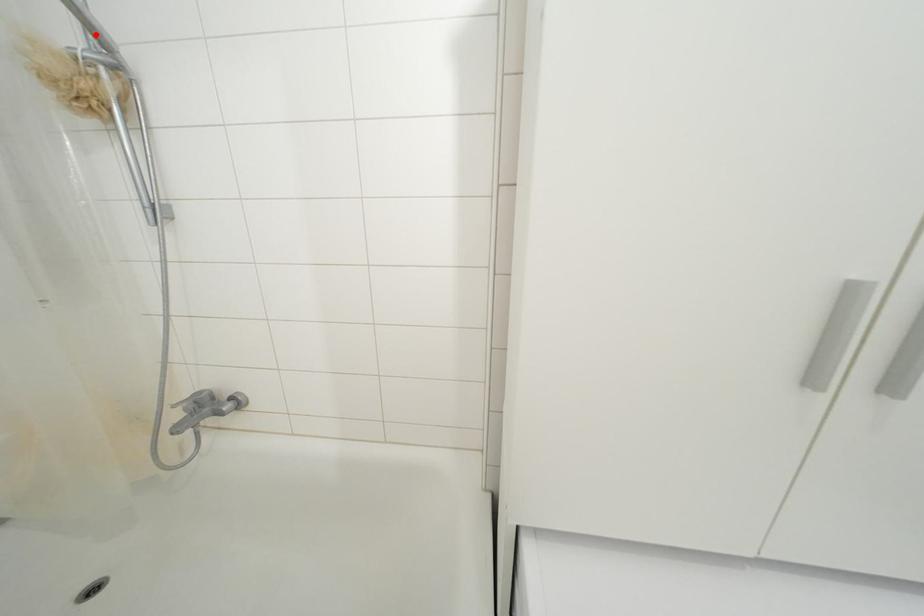
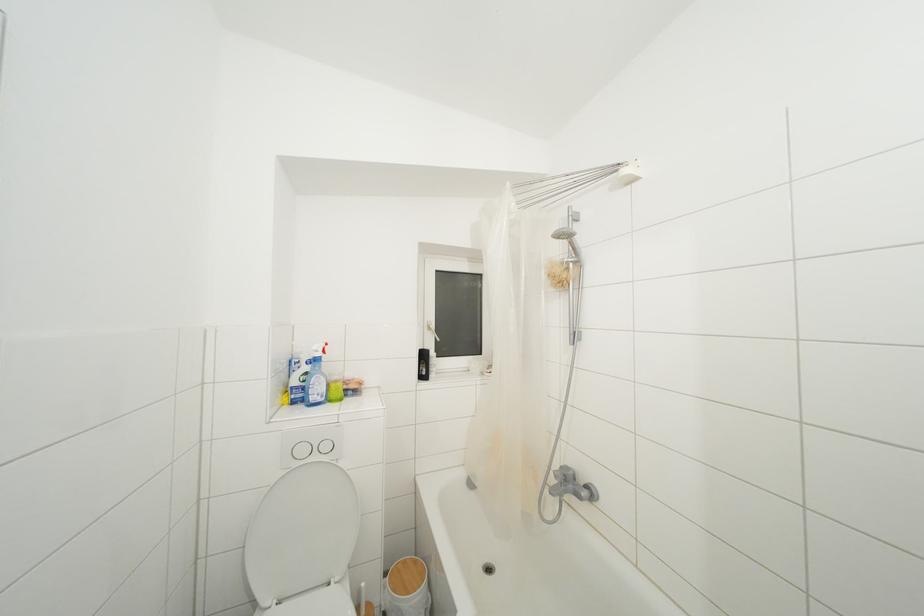
The point at the highlighted location is marked in the first image. Where is the corresponding point in the second image?

(578, 254)